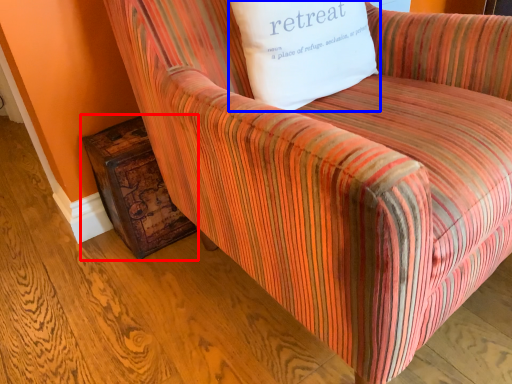
Question: Which point is closer to the camera, side table (highlighted by a red box) or pillow (highlighted by a blue box)?

Choices:
 (A) side table
 (B) pillow

Answer: (B)